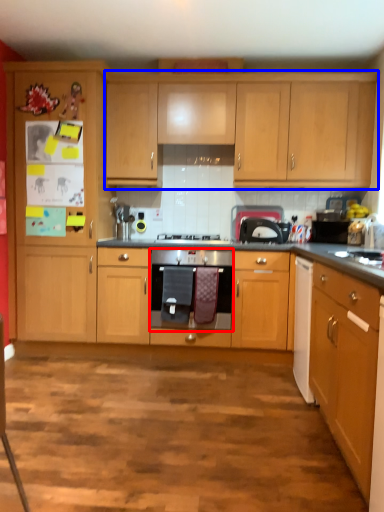
Question: Which of the following is the farthest to the observer, kitchen appliance (highlighted by a red box) or cabinetry (highlighted by a blue box)?

Choices:
 (A) kitchen appliance
 (B) cabinetry

Answer: (B)